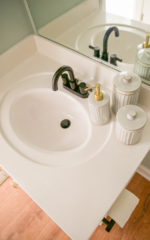
This screenshot has width=150, height=240. I want to click on sink bowl, so click(x=40, y=127).